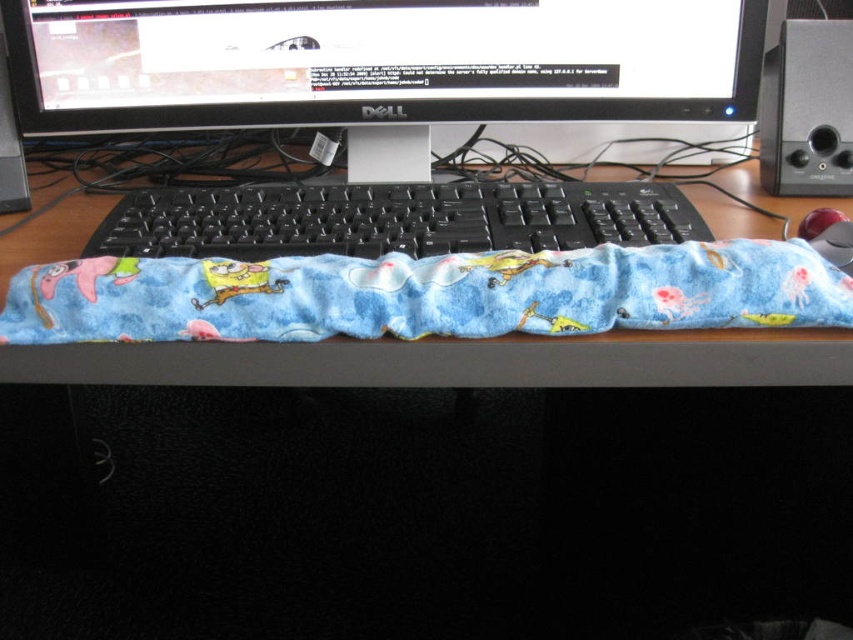
Between point (44, 340) and point (309, 184), which one is positioned in front?

Point (44, 340)

Does point (846, 285) lie in front of point (283, 212)?

Yes.

Between point (428, 272) and point (520, 220), which one is positioned behind?

The point (520, 220) is more distant.

Find the location of a particular element. The width and height of the screenshot is (853, 640). blue fleece blanket at center is located at coordinates (427, 294).

Does blue fleece keyboard cover at center have a greater width compared to black plastic keyboard at center?

Yes, blue fleece keyboard cover at center is wider than black plastic keyboard at center.

Between point (328, 122) and point (364, 209), which one is positioned behind?

The point (328, 122) is more distant.

You are a GUI agent. You are given a task and a screenshot of the screen. Output one action in this format:
    pyautogui.click(x=<x>, y=<y>)
    Task: Click on the blue fleece keyboard cover at center
    
    Given the screenshot: What is the action you would take?
    pyautogui.click(x=376, y=61)

Which of these two, blue fleece keyboard cover at center or blue fleece blanket at center, stands shorter?

blue fleece blanket at center is shorter.

Does blue fleece keyboard cover at center appear over blue fleece blanket at center?

Yes.

Does point (401, 86) come behind point (465, 276)?

Yes, point (401, 86) is behind point (465, 276).

At what (x,y) coordinates should I click in order to perform the action: click on blue fleece keyboard cover at center. Please return your answer as a coordinate pair (x, y). Looking at the image, I should click on (x=376, y=61).